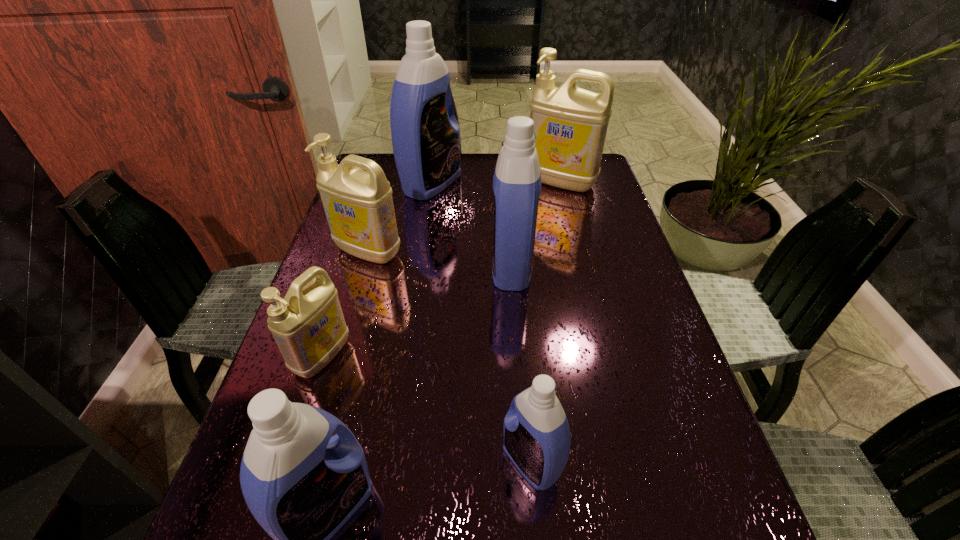
In the image, there is a desktop. At what (x,y) coordinates should I click in order to perform the action: click on vacant space at the right edge. Please return your answer as a coordinate pair (x, y). Looking at the image, I should click on (588, 231).

Image resolution: width=960 pixels, height=540 pixels. In order to click on blank region between the smallest blue detergent and the biggest blue detergent in this screenshot , I will do `click(481, 322)`.

Where is `free spot between the smallest blue detergent and the tallest object`? Image resolution: width=960 pixels, height=540 pixels. free spot between the smallest blue detergent and the tallest object is located at coordinates (481, 322).

You are a GUI agent. You are given a task and a screenshot of the screen. Output one action in this format:
    pyautogui.click(x=<x>, y=<y>)
    Task: Click on the free space that is in between the second nearest beige detergent and the tallest detergent
    The width and height of the screenshot is (960, 540).
    Given the screenshot: What is the action you would take?
    tap(399, 218)

Identify the location of blank region between the second nearest beige detergent and the rightmost object. (465, 217).

Image resolution: width=960 pixels, height=540 pixels. I want to click on blank region between the fifth farthest detergent and the second nearest beige detergent, so click(x=346, y=304).

This screenshot has height=540, width=960. Identify the location of free space between the biggest blue detergent and the nearest beige detergent. (376, 270).

The height and width of the screenshot is (540, 960). I want to click on object that is the second closest to the second farthest blue detergent, so click(570, 123).

Image resolution: width=960 pixels, height=540 pixels. Find the location of `object that is the fourth closest to the third nearest object`. object that is the fourth closest to the third nearest object is located at coordinates (537, 439).

The width and height of the screenshot is (960, 540). Find the location of `detergent that stands as the third closest to the second biggest beige detergent`. detergent that stands as the third closest to the second biggest beige detergent is located at coordinates (517, 179).